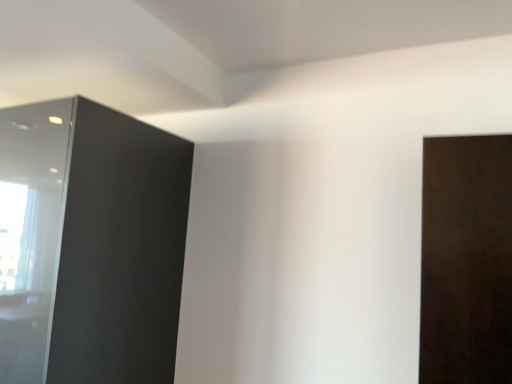
The height and width of the screenshot is (384, 512). Describe the element at coordinates (90, 244) in the screenshot. I see `glossy black dresser at left` at that location.

Based on the photo, in order to face glossy black dresser at left, should I rotate leftwards or rightwards?

Rotate your view left by about 23.467°.

Locate an element on the screen. This screenshot has width=512, height=384. glossy black dresser at left is located at coordinates [90, 244].

At what (x,y) coordinates should I click in order to perform the action: click on glossy black dresser at left. Please return your answer as a coordinate pair (x, y). Looking at the image, I should click on (90, 244).